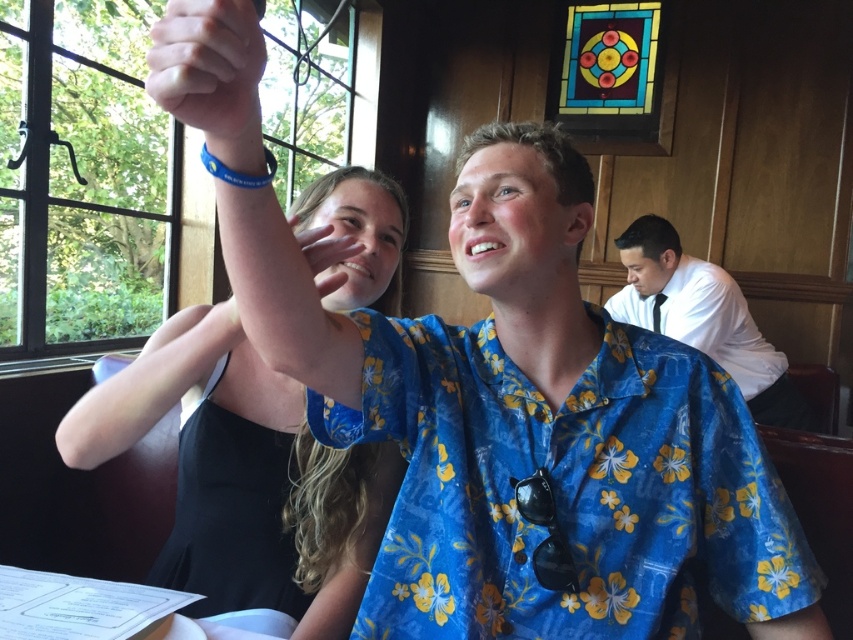
Question: Among these points, which one is farthest from the camera?

Choices:
 (A) (83, 465)
 (B) (196, 51)
 (C) (741, 304)

Answer: (C)

Question: Does black matte dress at upper left appear over white shirt at right?

Choices:
 (A) no
 (B) yes

Answer: (A)

Question: Which object is the farthest from the black matte dress at upper left?

Choices:
 (A) white shirt at right
 (B) matte blue wristband at upper center
 (C) matte skin hand at upper center
 (D) blue floral shirt at center

Answer: (A)

Question: Which object appears farthest from the camera in this image?

Choices:
 (A) black matte dress at upper left
 (B) matte blue wristband at upper center
 (C) white shirt at right

Answer: (C)

Question: Is black matte dress at upper left to the right of skinny white arm at upper center from the viewer's perspective?

Choices:
 (A) yes
 (B) no

Answer: (A)

Question: Does black matte dress at upper left have a larger size compared to matte skin hand at upper center?

Choices:
 (A) no
 (B) yes

Answer: (B)